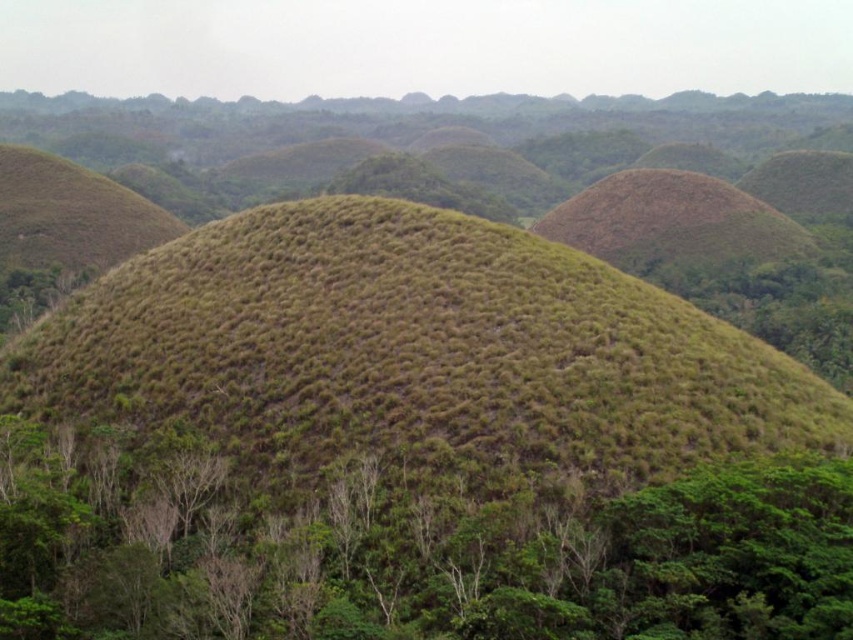
You are planning to plant a new tree between the green leafy tree at center and the brown grassy mound at upper right. The new tree requires a minimum of 500 feet of space between it and any existing trees. Can you plant the new tree in this location?

The green leafy tree at center and brown grassy mound at upper right are 691.04 feet apart from each other. Since the new tree requires at least 500 feet of space, planting it between them would be possible as the distance is sufficient.

Looking at this image, you are standing at the base of the brown grassy mound at upper right and want to find the green leafy tree at center. In which direction should you look?

The green leafy tree at center is to the left of brown grassy mound at upper right, so you should look to your left to find it.